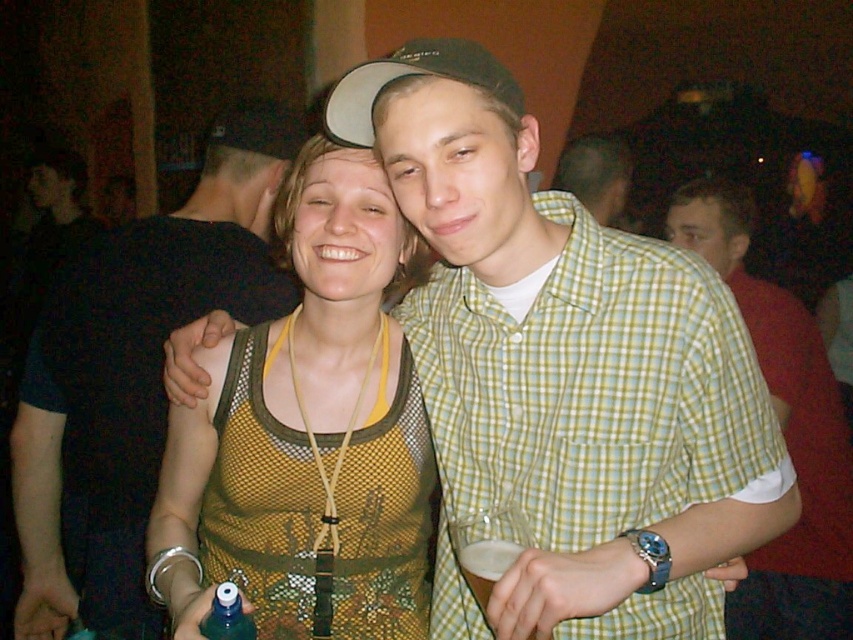
You are a photographer trying to capture a clear shot of both the matte green shirt at center and the foamy white liquid at lower center. Considering their positions and sizes, which object should you focus on first to ensure it fits entirely within the frame?

The matte green shirt at center might be wider than foamy white liquid at lower center, so you should focus on the matte green shirt at center first to ensure it fits entirely within the frame since it could take up more horizontal space.

You are standing in the middle of a crowded room at a party. You see the green checkered shirt at center at point (585, 401). If you want to move towards the green checkered shirt at center, which direction should you walk?

The green checkered shirt at center is located at point (585, 401), so you should walk towards that coordinate to reach it.